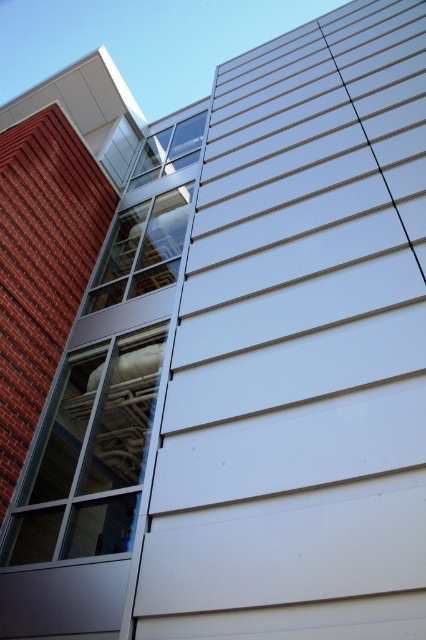
You are standing 10 feet away from the building exterior shown in the image. There is a point marked at coordinates point (123, 502). Can you reach this point without moving closer than your current position?

The point (123, 502) is 15.39 feet away from the viewer. Since you are currently 10 feet away, you cannot reach it without moving closer.

You are an architect examining the building exterior. You need to install a new sensor at the coordinates given in the description. Where should you place the sensor relative to the red brick siding at left?

The red brick siding at left is located at point (42, 266), so you should place the sensor at those coordinates relative to the red brick siding at left.